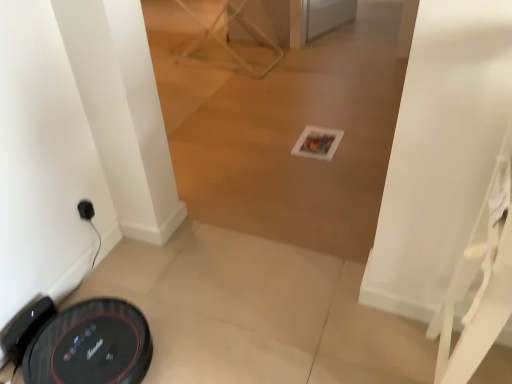
Question: Which direction should I rotate to look at white plastic folding table at upper center?

Choices:
 (A) right
 (B) left

Answer: (B)